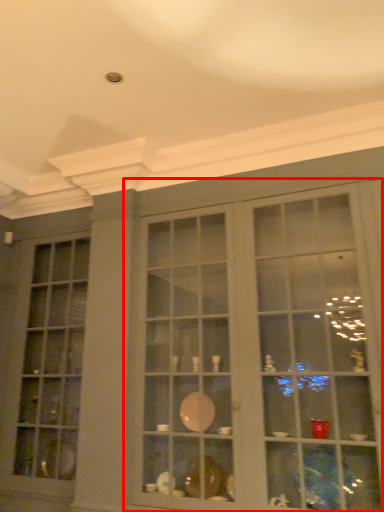
Question: In this image, where is shelf (annotated by the red box) located relative to window?

Choices:
 (A) left
 (B) right

Answer: (B)